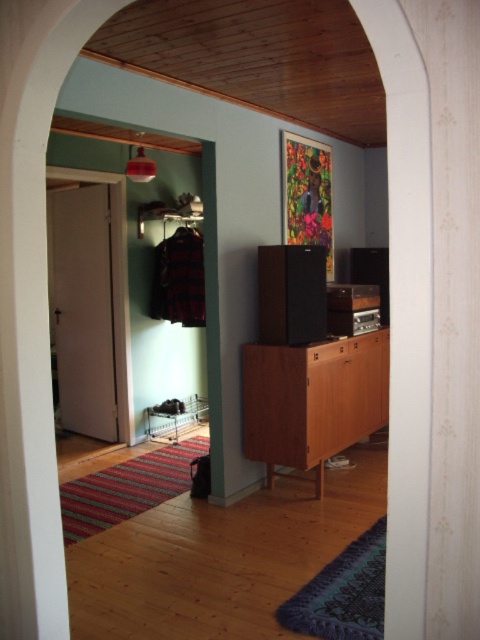
Question: Is brown wood cabinet at center below metallic silver rack at lower left?

Choices:
 (A) yes
 (B) no

Answer: (B)

Question: Considering the relative positions of brown wood cabinet at center and metallic silver rack at lower left in the image provided, where is brown wood cabinet at center located with respect to metallic silver rack at lower left?

Choices:
 (A) below
 (B) above

Answer: (B)

Question: Which point appears closest to the camera in this image?

Choices:
 (A) (334, 340)
 (B) (172, 413)

Answer: (A)

Question: Does brown wood cabinet at center have a smaller size compared to metallic silver rack at lower left?

Choices:
 (A) yes
 (B) no

Answer: (B)

Question: Which object appears closest to the camera in this image?

Choices:
 (A) metallic silver rack at lower left
 (B) brown wood cabinet at center

Answer: (B)